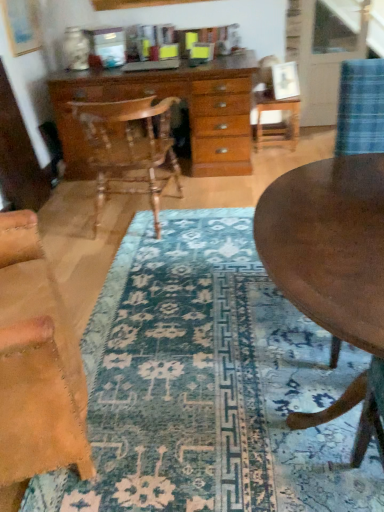
I want to click on free space in front of wooden side table at center, so click(x=281, y=159).